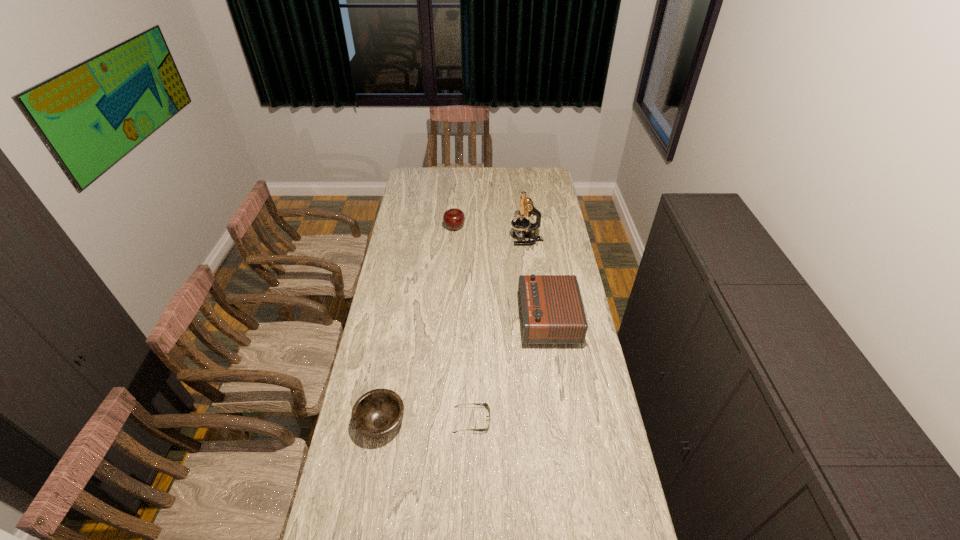
Identify the location of free space between the microscope and the apple. The height and width of the screenshot is (540, 960). (491, 234).

Find the location of `vacant point located between the third tallest object and the microscope`. vacant point located between the third tallest object and the microscope is located at coordinates (491, 234).

Where is `object identified as the second closest to the apple`? This screenshot has height=540, width=960. object identified as the second closest to the apple is located at coordinates (551, 310).

Identify which object is the third closest to the shortest object. Please provide its 2D coordinates. Your answer should be formatted as a tuple, i.e. [(x, y)], where the tuple contains the x and y coordinates of a point satisfying the conditions above.

[(526, 207)]

Find the location of a particular element. This screenshot has height=540, width=960. free location that satisfies the following two spatial constraints: 1. on the tuning display of the radio receiver; 2. on the front side of the fourth tallest object is located at coordinates (564, 423).